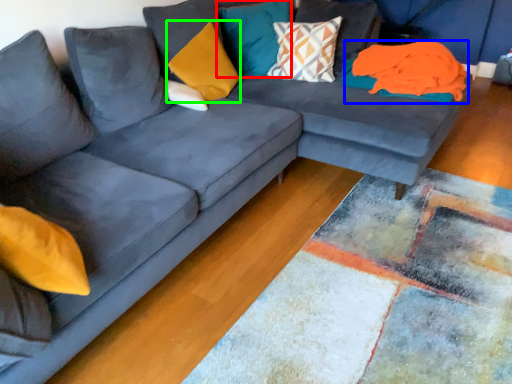
Question: Considering the real-world distances, which object is farthest from pillow (highlighted by a red box)? material (highlighted by a blue box) or pillow (highlighted by a green box)?

Choices:
 (A) material
 (B) pillow

Answer: (A)